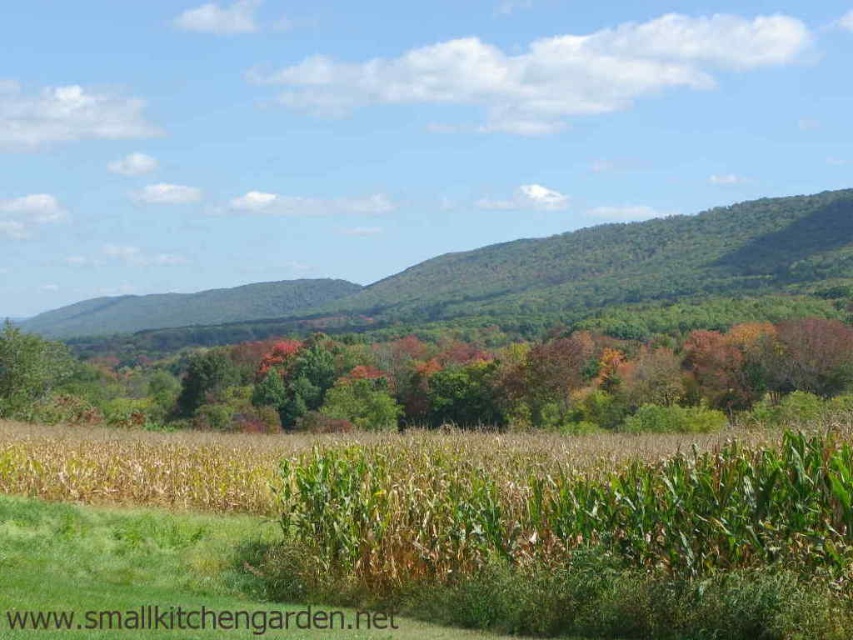
Question: From the image, what is the correct spatial relationship of green leafy corn at center in relation to green leafy forest at center?

Choices:
 (A) left
 (B) right

Answer: (B)

Question: Can you confirm if green leafy corn at center is smaller than green leafy forest at center?

Choices:
 (A) yes
 (B) no

Answer: (A)

Question: Which of the following is the closest to the observer?

Choices:
 (A) green matte tree at center
 (B) green leafy corn at center

Answer: (B)

Question: Which is nearer to the green matte tree at center?

Choices:
 (A) green leafy corn at center
 (B) green leafy forest at center

Answer: (B)

Question: Which object is farther from the camera taking this photo?

Choices:
 (A) green leafy forest at center
 (B) green leafy corn at center

Answer: (A)

Question: Is green leafy corn at center in front of green leafy forest at center?

Choices:
 (A) no
 (B) yes

Answer: (B)